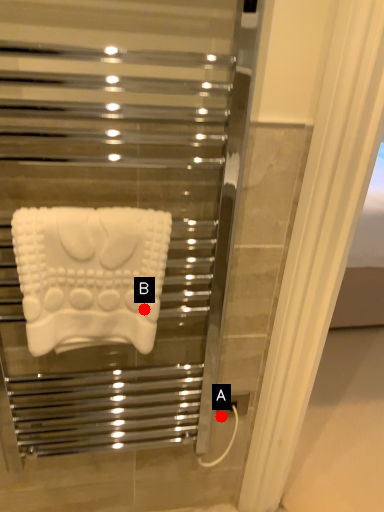
Question: Two points are circled on the image, labeled by A and B beside each circle. Which point appears farthest from the camera in this image?

Choices:
 (A) A is further
 (B) B is further

Answer: (A)